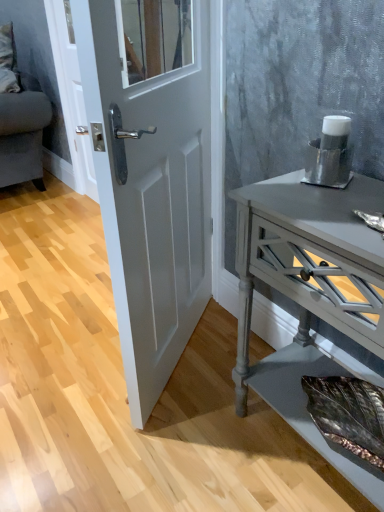
Image resolution: width=384 pixels, height=512 pixels. I want to click on free space above matte gray wooden nightstand at right (from a real-world perspective), so click(333, 205).